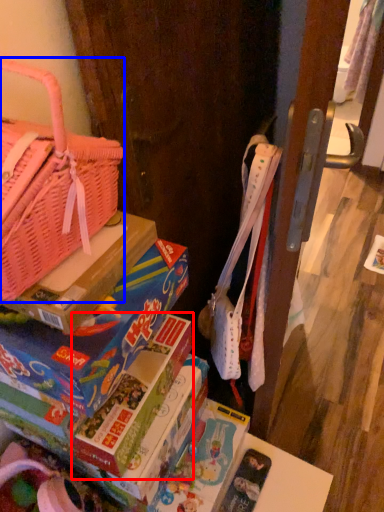
Question: Which object is closer to the camera taking this photo, paperback book (highlighted by a red box) or handbag (highlighted by a blue box)?

Choices:
 (A) paperback book
 (B) handbag

Answer: (B)